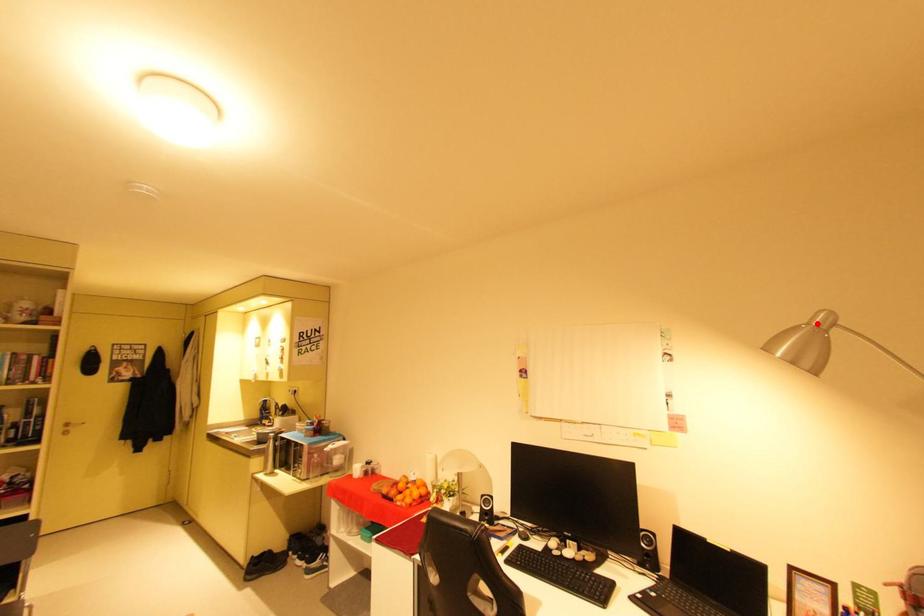
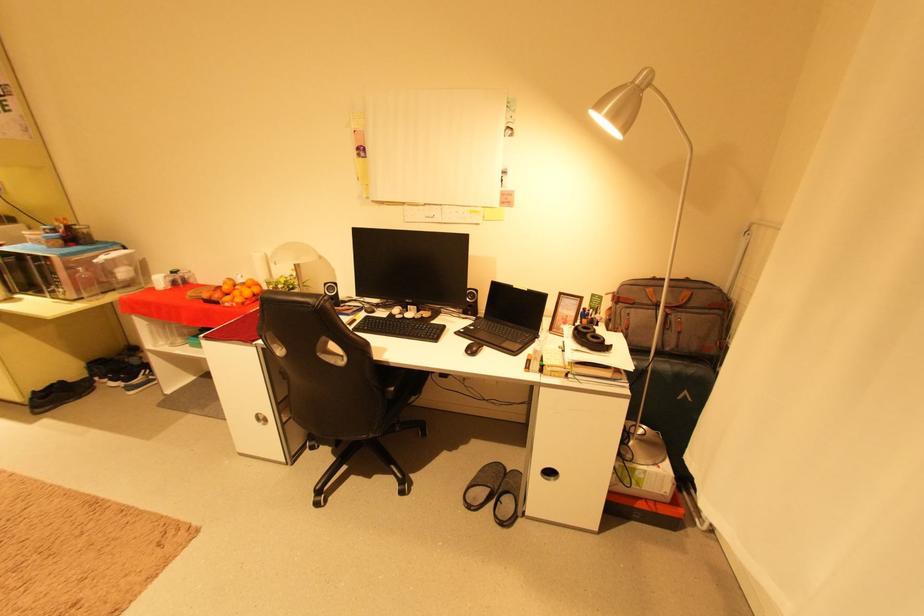
Locate, in the second image, the point that corresponds to the highlighted location in the first image.

(639, 83)